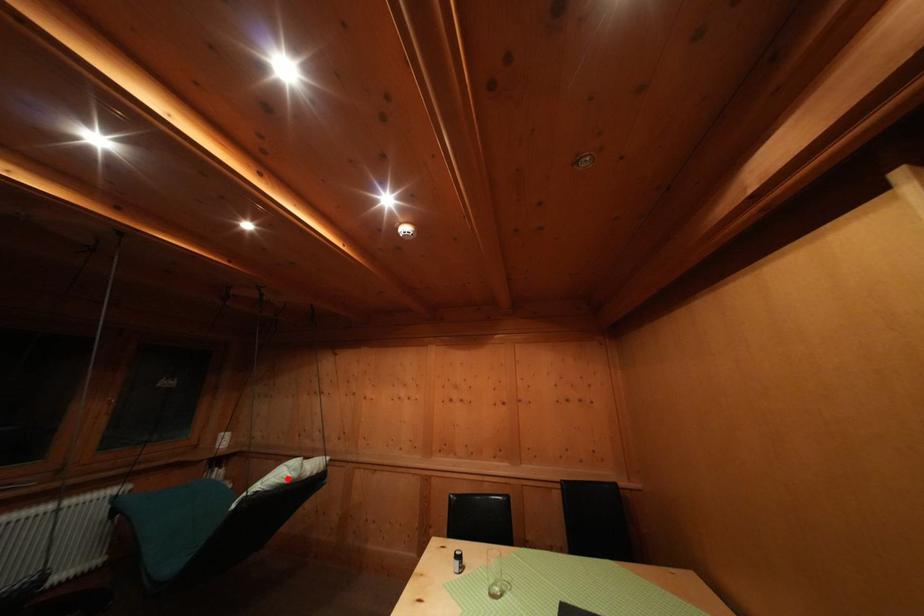
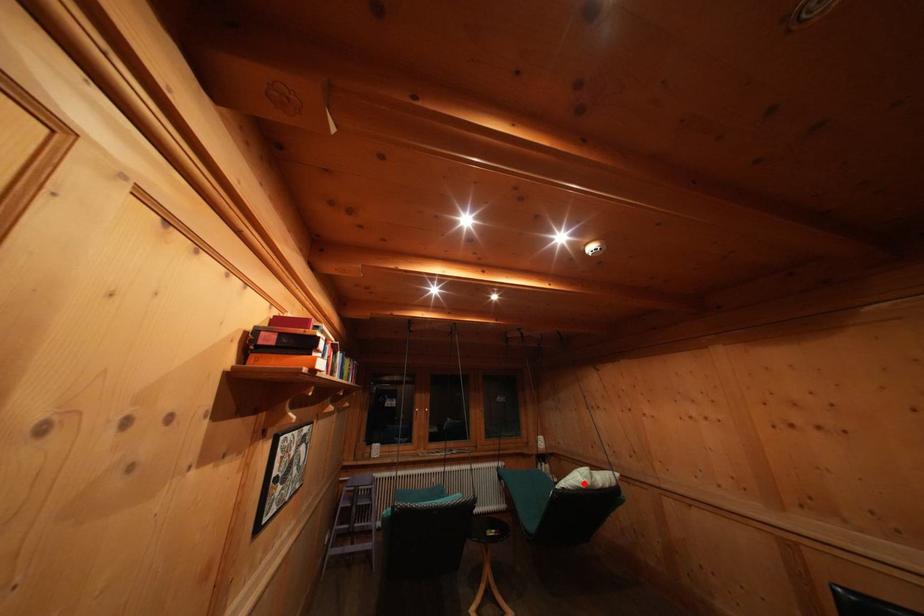
I am providing you with two images of the same scene from different viewpoints. A red point is marked on the first image and another point is marked on the second image. Is the red point in image1 aligned with the point shown in image2?

Yes